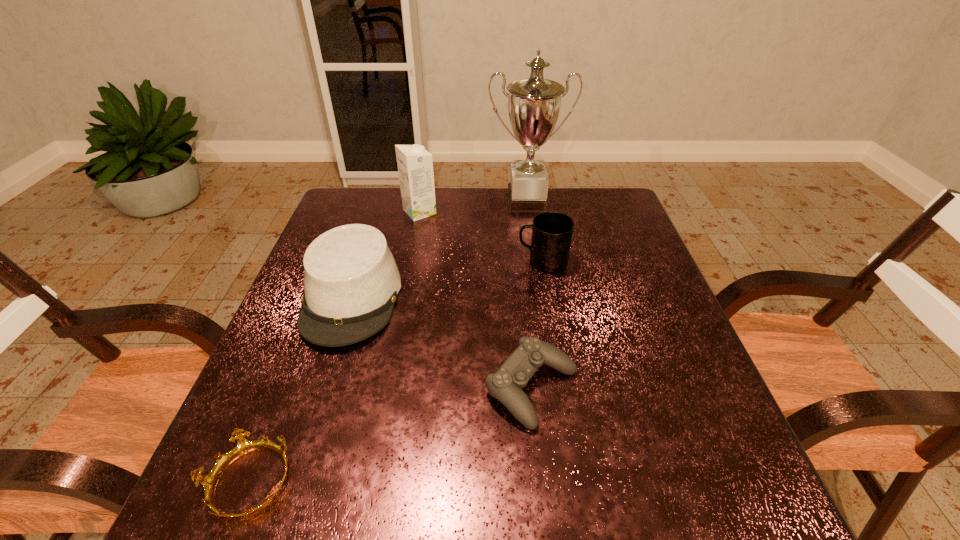
Find the location of `the tallest object`. the tallest object is located at coordinates (534, 104).

Identify the location of carton. (415, 164).

Where is `mug`? Image resolution: width=960 pixels, height=540 pixels. mug is located at coordinates (552, 232).

Image resolution: width=960 pixels, height=540 pixels. Find the location of `hat`. hat is located at coordinates (351, 281).

Find the location of a particular element. control is located at coordinates (506, 385).

Image resolution: width=960 pixels, height=540 pixels. Identify the location of crown. (244, 446).

Identify the location of free space located 0.110m at the front view of the tallest object. Image resolution: width=960 pixels, height=540 pixels. (532, 236).

In order to click on blank space located 0.260m on the right of the fifth shortest object in this screenshot , I will do `click(522, 212)`.

Locate an element on the screen. This screenshot has height=540, width=960. blank area located on the side of the mug with the handle is located at coordinates (423, 261).

Find the location of a particular element. Image resolution: width=960 pixels, height=540 pixels. blank space located on the side of the mug with the handle is located at coordinates (435, 261).